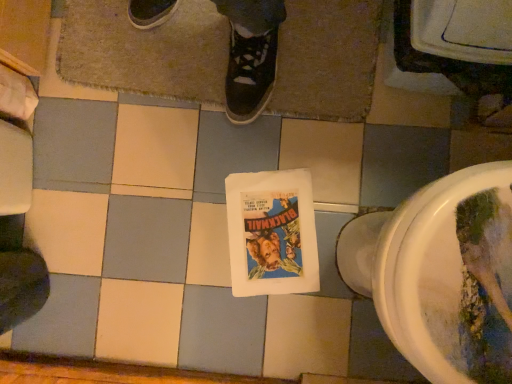
The width and height of the screenshot is (512, 384). I want to click on vacant space behind white glossy toilet at lower right, so click(x=325, y=158).